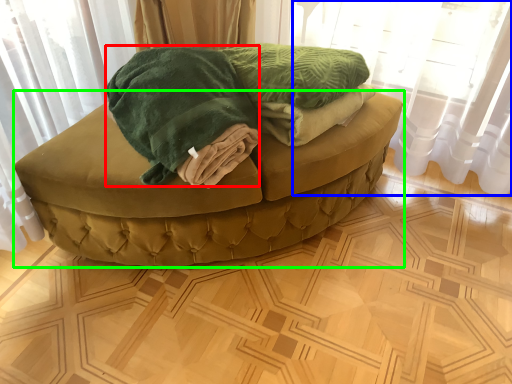
Question: Which object is positioned closest to cloth (highlighted by a red box)? Select from curtain (highlighted by a blue box) and furniture (highlighted by a green box).

Choices:
 (A) curtain
 (B) furniture

Answer: (B)